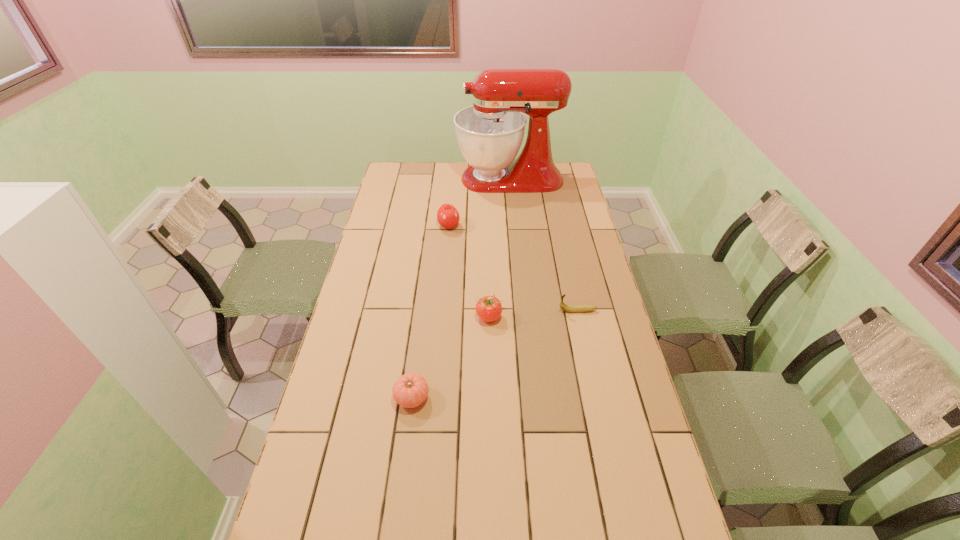
At what (x,y) coordinates should I click in order to perform the action: click on mixer. Please return your answer as a coordinate pair (x, y). Image resolution: width=960 pixels, height=540 pixels. Looking at the image, I should click on (490, 133).

Identify the location of the tallest object. (490, 133).

At what (x,y) coordinates should I click in order to perform the action: click on the fourth shortest object. Please return your answer as a coordinate pair (x, y). The height and width of the screenshot is (540, 960). Looking at the image, I should click on (448, 217).

This screenshot has height=540, width=960. What are the coordinates of `apple` in the screenshot? It's located at (448, 217).

At what (x,y) coordinates should I click in order to perform the action: click on the right tomato. Please return your answer as a coordinate pair (x, y). The width and height of the screenshot is (960, 540). Looking at the image, I should click on (488, 308).

This screenshot has width=960, height=540. I want to click on banana, so click(x=568, y=308).

Locate an element on the screen. The image size is (960, 540). the left tomato is located at coordinates (410, 390).

I want to click on the nearest object, so click(x=410, y=390).

The image size is (960, 540). Find the location of `vacant space situated at the attachment hub of the farthest object`. vacant space situated at the attachment hub of the farthest object is located at coordinates (395, 179).

Locate an element on the screen. Image resolution: width=960 pixels, height=540 pixels. vacant region located 0.260m at the attachment hub of the farthest object is located at coordinates (403, 179).